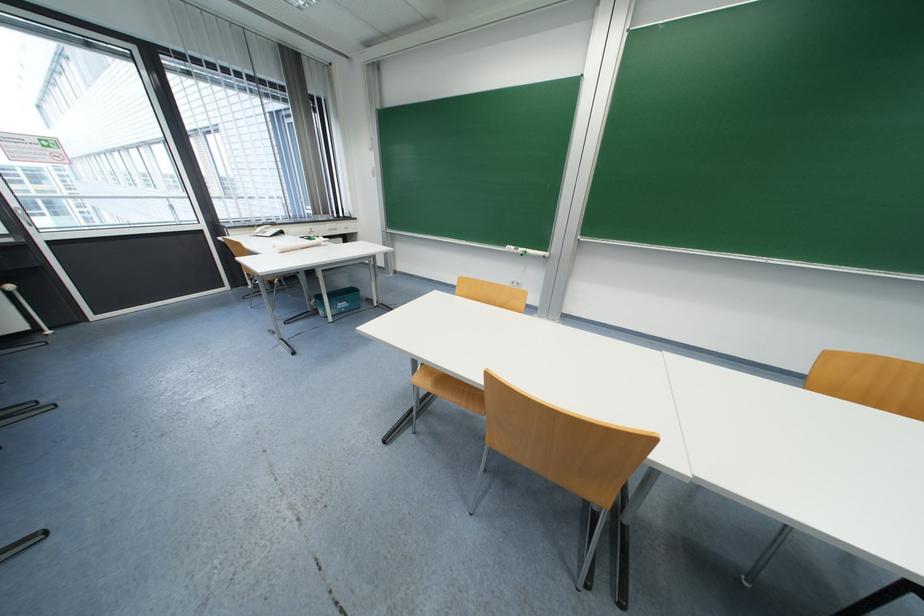
The image size is (924, 616). Find the location of `telephone handset`. telephone handset is located at coordinates (268, 231).